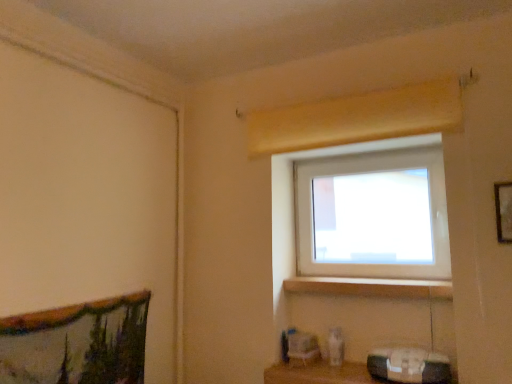
Identify the location of vacant space situated above wooden at lower center (from a real-world perspective). (372, 282).